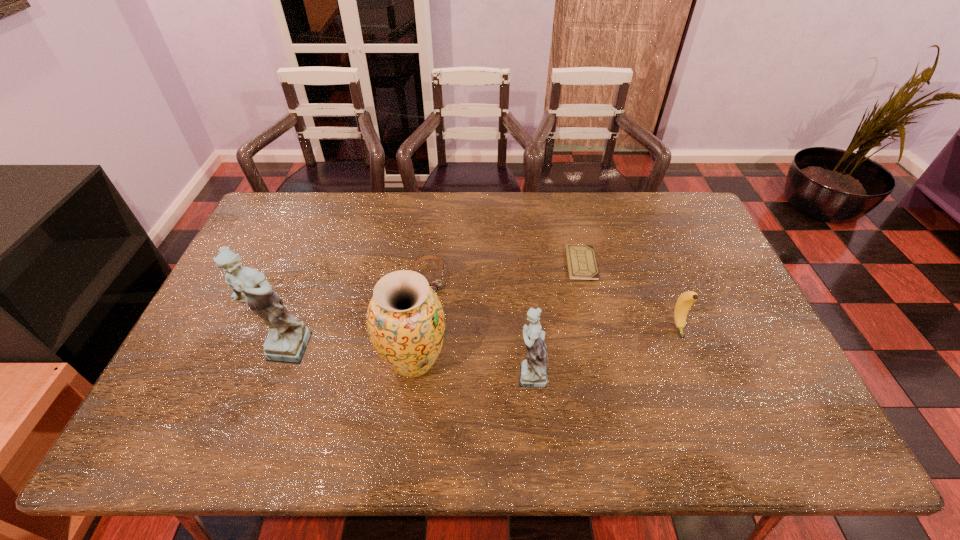
You are a GUI agent. You are given a task and a screenshot of the screen. Output one action in this format:
    pyautogui.click(x=<x>, y=<y>)
    Task: Click on the vacant space located 0.090m on the front-facing side of the left figurine
    This screenshot has width=960, height=540.
    Given the screenshot: What is the action you would take?
    tap(260, 409)

Identify the location of vacant space located on the front-facing side of the shorter figurine. The height and width of the screenshot is (540, 960). (490, 373).

You are a GUI agent. You are given a task and a screenshot of the screen. Output one action in this format:
    pyautogui.click(x=<x>, y=<y>)
    Task: Click on the free spot located on the front-facing side of the shorter figurine
    The image size is (960, 540).
    Given the screenshot: What is the action you would take?
    pyautogui.click(x=454, y=373)

Image resolution: width=960 pixels, height=540 pixels. I want to click on blank space located on the front-facing side of the shorter figurine, so click(x=450, y=373).

I want to click on vacant area located on the front of the shortest object, so (598, 336).

Where is `vacant space located on the front-facing side of the second shortest object`? vacant space located on the front-facing side of the second shortest object is located at coordinates (421, 350).

Where is `vacant space located 0.190m from the stem of the rightmost object`? This screenshot has width=960, height=540. vacant space located 0.190m from the stem of the rightmost object is located at coordinates (708, 402).

What are the coordinates of `vacant space located on the back of the vase` in the screenshot? It's located at tap(421, 298).

Where is `figurine that is at the near edge`? This screenshot has width=960, height=540. figurine that is at the near edge is located at coordinates click(x=534, y=371).

Where is `vase that is positioned at the near edge`? The image size is (960, 540). vase that is positioned at the near edge is located at coordinates (405, 320).